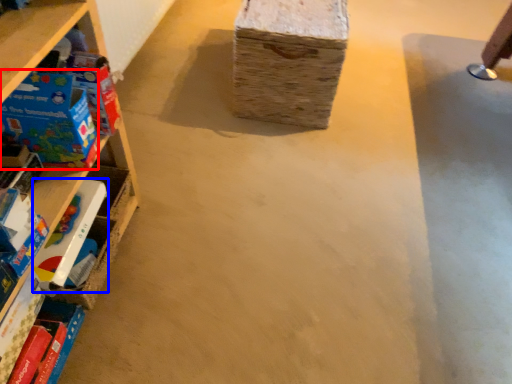
Question: Which of the following is the farthest to the observer, toy (highlighted by a red box) or toy (highlighted by a blue box)?

Choices:
 (A) toy
 (B) toy

Answer: (B)